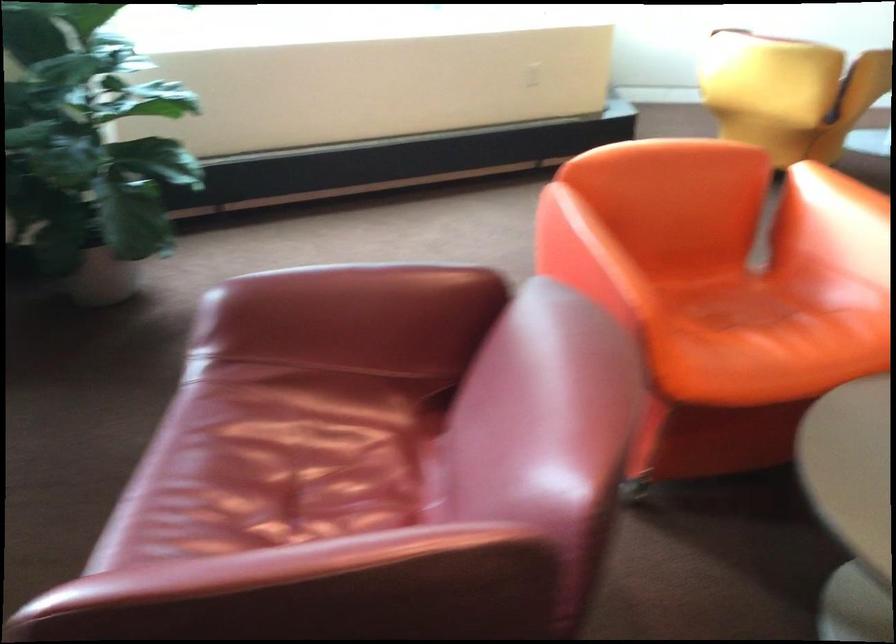
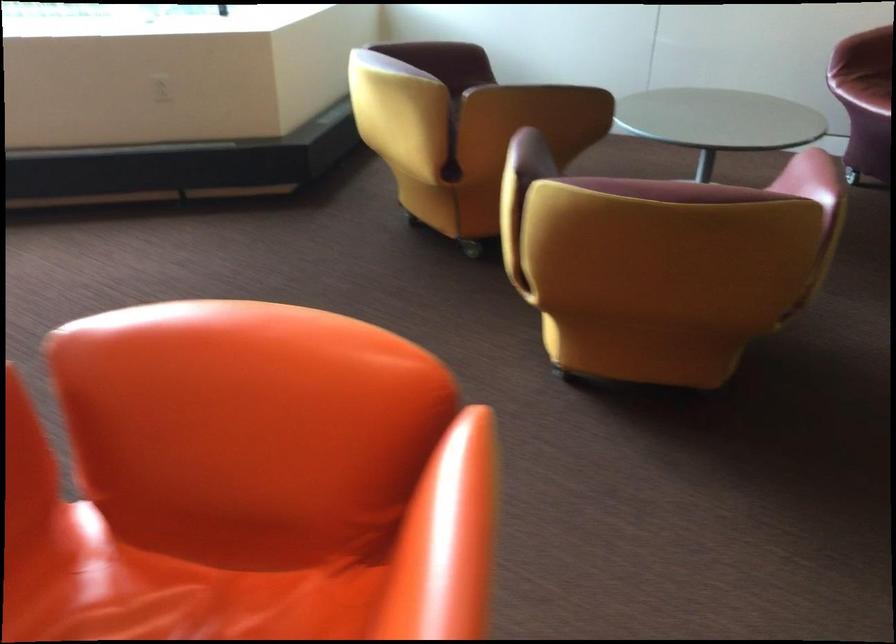
What movement of the cameraman would produce the second image?

The cameraman walked toward right, forward.